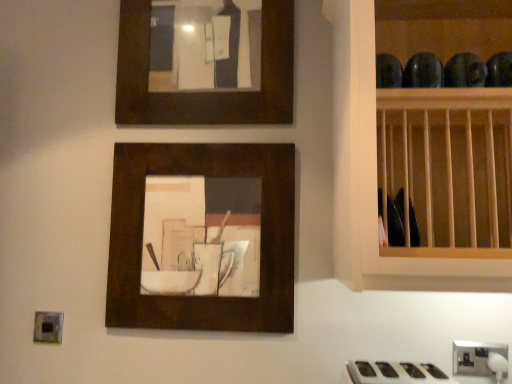
Question: In terms of width, does white glossy gas stove at lower right look wider or thinner when compared to matte wood picture frame at center, which is counted as the 1th picture frame, starting from the bottom?

Choices:
 (A) wide
 (B) thin

Answer: (A)

Question: In terms of size, does white glossy gas stove at lower right appear bigger or smaller than matte wood picture frame at center, arranged as the 2th picture frame when viewed from the top?

Choices:
 (A) small
 (B) big

Answer: (A)

Question: Based on their relative distances, which object is farther from the matte brown picture frame at upper center, which ranks as the second picture frame in bottom-to-top order?

Choices:
 (A) satin silver outlet at lower right
 (B) white glossy gas stove at lower right
 (C) matte wood picture frame at center, arranged as the 2th picture frame when viewed from the top

Answer: (A)

Question: Estimate the real-world distances between objects in this image. Which object is closer to the matte brown picture frame at upper center, the 1th picture frame from the top?

Choices:
 (A) satin silver outlet at lower right
 (B) matte wood picture frame at center, arranged as the 2th picture frame when viewed from the top
 (C) white glossy gas stove at lower right

Answer: (B)